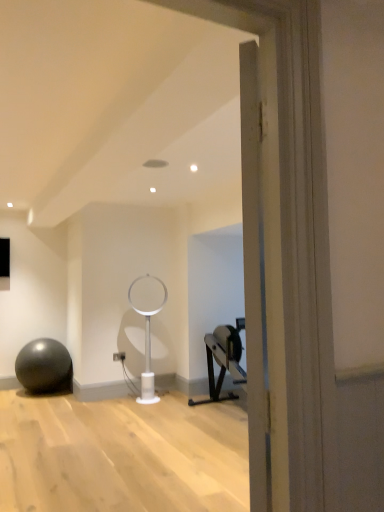
Question: Considering the positions of point pos(59,375) and point pos(150,394), is point pos(59,375) closer or farther from the camera than point pos(150,394)?

Choices:
 (A) closer
 (B) farther

Answer: (B)

Question: From a real-world perspective, relative to white plastic table lamp at center, is matte gray ball at left vertically above or below?

Choices:
 (A) below
 (B) above

Answer: (A)

Question: In the image, is matte gray ball at left on the left side or the right side of white plastic table lamp at center?

Choices:
 (A) right
 (B) left

Answer: (B)

Question: From the image's perspective, is white plastic table lamp at center positioned above or below matte gray ball at left?

Choices:
 (A) above
 (B) below

Answer: (A)

Question: Is point (152, 373) positioned closer to the camera than point (16, 369)?

Choices:
 (A) closer
 (B) farther

Answer: (A)

Question: Do you think white plastic table lamp at center is within matte gray ball at left, or outside of it?

Choices:
 (A) outside
 (B) inside

Answer: (A)

Question: From a real-world perspective, is white plastic table lamp at center positioned above or below matte gray ball at left?

Choices:
 (A) above
 (B) below

Answer: (A)